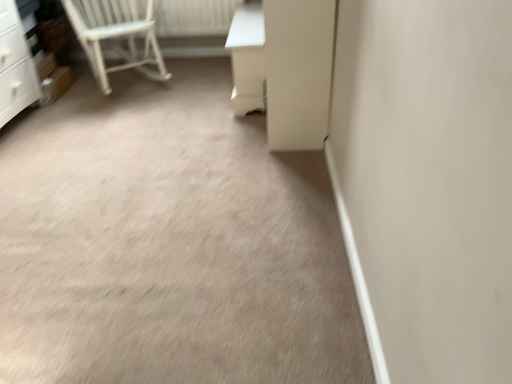
Question: Considering the relative sizes of white wooden chair at upper left and white glossy screen door at center in the image provided, is white wooden chair at upper left smaller than white glossy screen door at center?

Choices:
 (A) yes
 (B) no

Answer: (B)

Question: Can you confirm if white wooden chair at upper left is bigger than white glossy screen door at center?

Choices:
 (A) yes
 (B) no

Answer: (A)

Question: Can you confirm if white wooden chair at upper left is positioned to the right of white glossy screen door at center?

Choices:
 (A) no
 (B) yes

Answer: (A)

Question: Considering the relative positions of white wooden chair at upper left and white glossy screen door at center in the image provided, is white wooden chair at upper left in front of white glossy screen door at center?

Choices:
 (A) no
 (B) yes

Answer: (A)

Question: Does white wooden chair at upper left touch white glossy screen door at center?

Choices:
 (A) no
 (B) yes

Answer: (A)

Question: Considering the relative sizes of white wooden chair at upper left and white glossy screen door at center in the image provided, is white wooden chair at upper left wider than white glossy screen door at center?

Choices:
 (A) yes
 (B) no

Answer: (A)

Question: Are white glossy screen door at center and white glossy vanity at upper right located far from each other?

Choices:
 (A) yes
 (B) no

Answer: (B)

Question: From a real-world perspective, is white glossy screen door at center on white glossy vanity at upper right?

Choices:
 (A) yes
 (B) no

Answer: (A)

Question: Is white glossy vanity at upper right surrounded by white glossy screen door at center?

Choices:
 (A) no
 (B) yes

Answer: (A)

Question: Can you confirm if white glossy screen door at center is smaller than white glossy vanity at upper right?

Choices:
 (A) yes
 (B) no

Answer: (B)

Question: From the image's perspective, is white glossy screen door at center located beneath white glossy vanity at upper right?

Choices:
 (A) no
 (B) yes

Answer: (B)

Question: Does white glossy screen door at center have a greater height compared to white glossy vanity at upper right?

Choices:
 (A) yes
 (B) no

Answer: (A)

Question: Considering the relative sizes of white wooden chair at upper left and white painted wood radiator at upper left in the image provided, is white wooden chair at upper left shorter than white painted wood radiator at upper left?

Choices:
 (A) yes
 (B) no

Answer: (B)